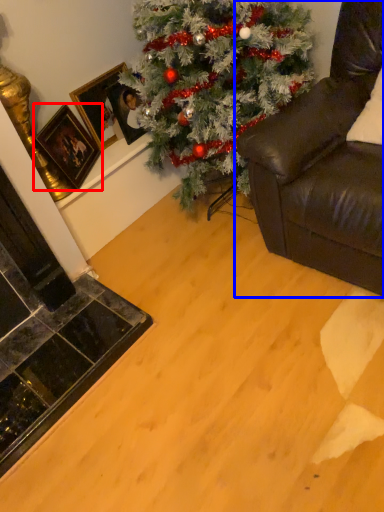
Question: Which object appears closest to the camera in this image, picture frame (highlighted by a red box) or studio couch (highlighted by a blue box)?

Choices:
 (A) picture frame
 (B) studio couch

Answer: (B)